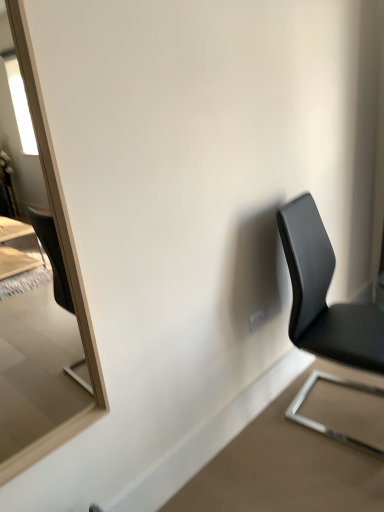
Question: Is black leather chair at right taller or shorter than matte wooden mirror at left?

Choices:
 (A) short
 (B) tall

Answer: (A)

Question: From the image's perspective, is black leather chair at right above or below matte wooden mirror at left?

Choices:
 (A) above
 (B) below

Answer: (B)

Question: From a real-world perspective, is black leather chair at right positioned above or below matte wooden mirror at left?

Choices:
 (A) below
 (B) above

Answer: (A)

Question: From the image's perspective, is matte wooden mirror at left positioned above or below black leather chair at right?

Choices:
 (A) below
 (B) above

Answer: (B)

Question: Considering the relative positions of matte wooden mirror at left and black leather chair at right in the image provided, is matte wooden mirror at left to the left or to the right of black leather chair at right?

Choices:
 (A) right
 (B) left

Answer: (B)

Question: Do you think matte wooden mirror at left is within black leather chair at right, or outside of it?

Choices:
 (A) inside
 (B) outside

Answer: (B)

Question: From their relative heights in the image, would you say matte wooden mirror at left is taller or shorter than black leather chair at right?

Choices:
 (A) tall
 (B) short

Answer: (A)